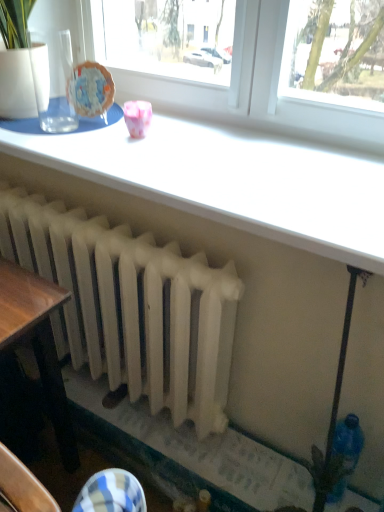
The image size is (384, 512). What are the coordinates of `free space on the front side of pink glossy cup at upper center` in the screenshot? It's located at (134, 158).